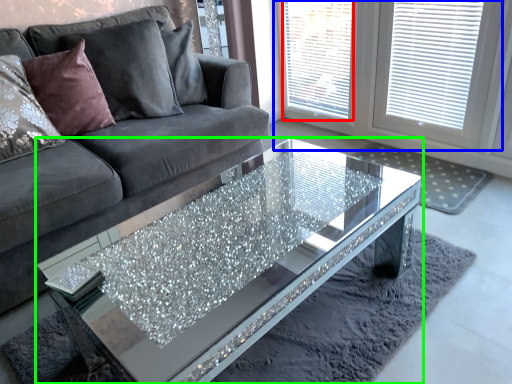
Question: Which object is positioned closest to window screen (highlighted by a red box)? Select from window (highlighted by a blue box) and coffee table (highlighted by a green box).

Choices:
 (A) window
 (B) coffee table

Answer: (A)